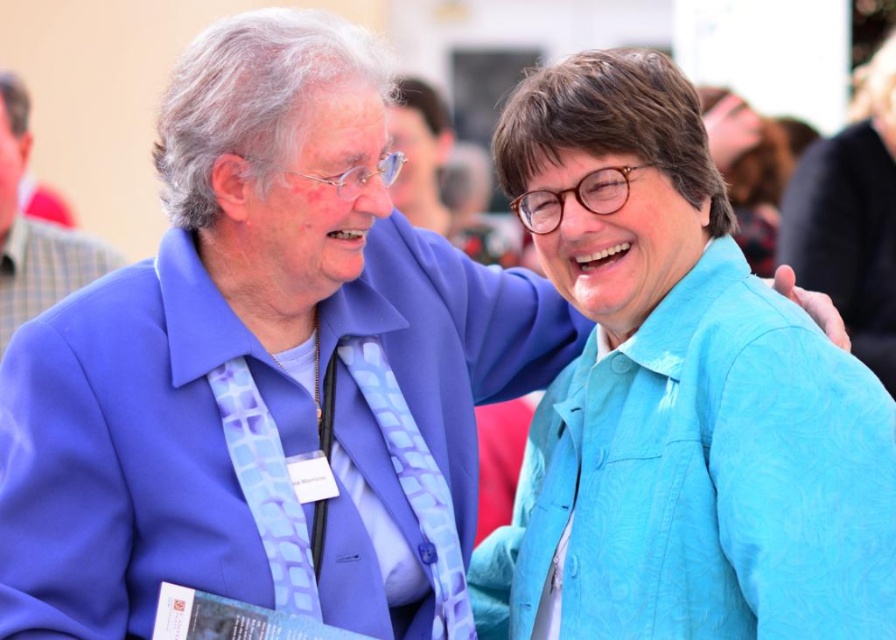
Question: Does blue fabric shirt at right lie in front of blue textured jacket at upper right?

Choices:
 (A) no
 (B) yes

Answer: (B)

Question: Which point is farther to the camera?

Choices:
 (A) (765, 176)
 (B) (853, 177)
 (C) (47, 300)
 (D) (678, 372)

Answer: (A)

Question: Which object is positioned closest to the blue textured jacket at upper right?

Choices:
 (A) matte blue suit at left
 (B) turquoise fabric shirt at right
 (C) blue fabric shirt at right

Answer: (C)

Question: Which of the following is the closest to the observer?

Choices:
 (A) (750, 202)
 (B) (48, 244)
 (C) (552, 209)
 (D) (892, 64)

Answer: (C)

Question: Observing the image, what is the correct spatial positioning of blue fabric shirt at right in reference to blue textured jacket at upper right?

Choices:
 (A) above
 (B) below

Answer: (B)

Question: Is turquoise fabric shirt at right to the right of matte blue suit at left from the viewer's perspective?

Choices:
 (A) no
 (B) yes

Answer: (B)